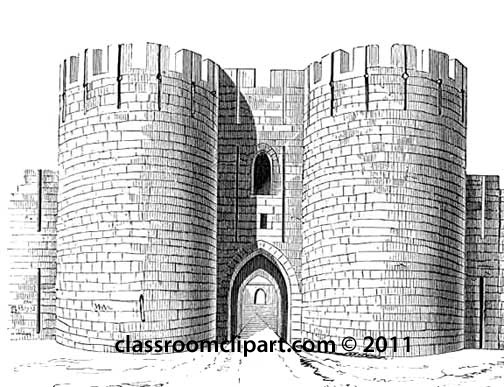
Identify the location of right wall. [x=474, y=251].